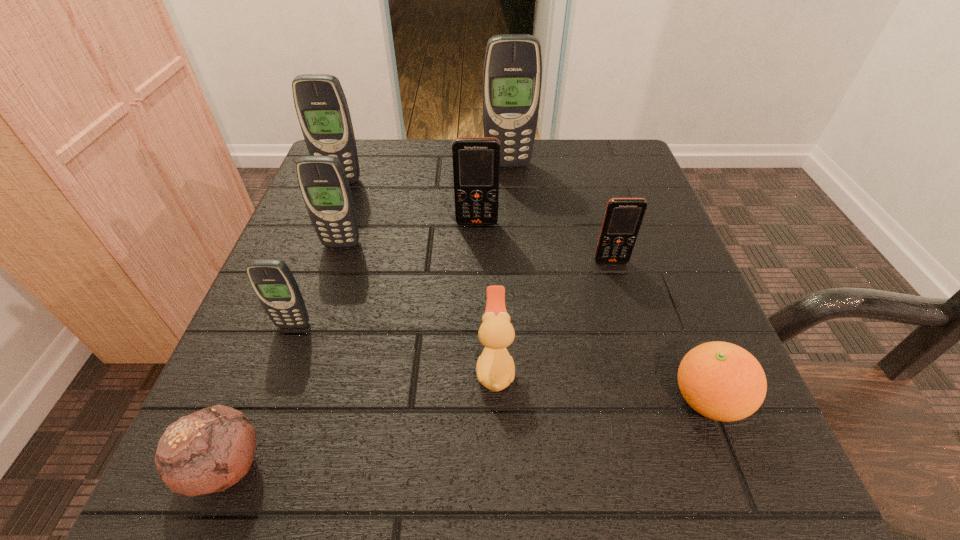
Where is `cellular telephone object that ranks as the third closest to the farthest cellular telephone`? This screenshot has width=960, height=540. cellular telephone object that ranks as the third closest to the farthest cellular telephone is located at coordinates (623, 217).

Locate an element on the screen. The height and width of the screenshot is (540, 960). the fourth closest cellular telephone to the tallest object is located at coordinates (324, 186).

Select which gray cellular telephone is the closest to the orange. Please provide its 2D coordinates. Your answer should be formatted as a tuple, i.e. [(x, y)], where the tuple contains the x and y coordinates of a point satisfying the conditions above.

[(272, 281)]

Locate an element on the screen. the third closest gray cellular telephone to the duck is located at coordinates (512, 76).

Find the location of `vacant area that satisfies the following two spatial constraints: 1. on the screen of the farthest gray cellular telephone; 2. on the beak of the tan duck`. vacant area that satisfies the following two spatial constraints: 1. on the screen of the farthest gray cellular telephone; 2. on the beak of the tan duck is located at coordinates (524, 367).

The image size is (960, 540). Find the location of `blank area in the image that satisfies the following two spatial constraints: 1. on the screen of the orange; 2. on the right side of the third nearest cellular telephone`. blank area in the image that satisfies the following two spatial constraints: 1. on the screen of the orange; 2. on the right side of the third nearest cellular telephone is located at coordinates (291, 400).

Find the location of a particular element. The width and height of the screenshot is (960, 540). free space that satisfies the following two spatial constraints: 1. on the screen of the orange orange; 2. on the right side of the fifth nearest object is located at coordinates (652, 400).